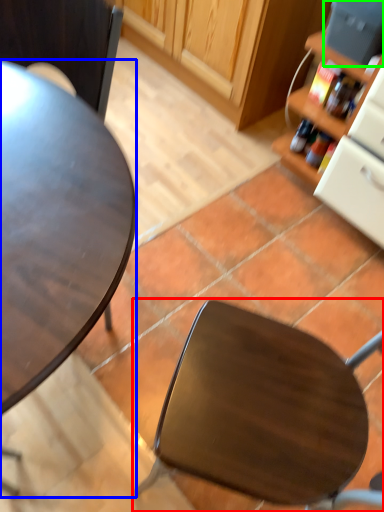
Question: Which object is positioned farthest from chair (highlighted by a red box)? Select from desk (highlighted by a blue box) and appliance (highlighted by a green box).

Choices:
 (A) desk
 (B) appliance

Answer: (B)